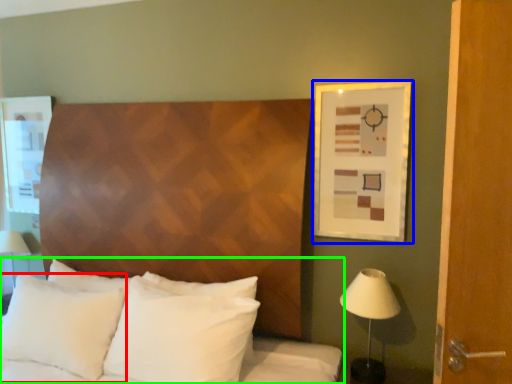
Question: Which is farther away from pillow (highlighted by a red box)? picture frame (highlighted by a blue box) or bed (highlighted by a green box)?

Choices:
 (A) picture frame
 (B) bed

Answer: (A)